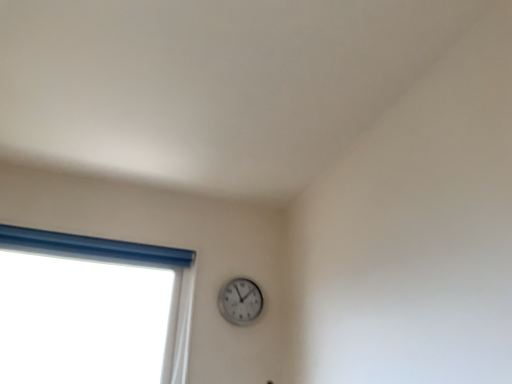
What are the coordinates of `white plastic wall clock at upper center` in the screenshot? It's located at (240, 301).

The height and width of the screenshot is (384, 512). Describe the element at coordinates (240, 301) in the screenshot. I see `white plastic wall clock at upper center` at that location.

Identify the location of white plastic window at left. (90, 309).

What do you see at coordinates (90, 309) in the screenshot?
I see `white plastic window at left` at bounding box center [90, 309].

What is the approximate height of white plastic window at left?

A: It is 28.00 inches.

The image size is (512, 384). I want to click on white plastic wall clock at upper center, so click(x=240, y=301).

Visually, is white plastic window at left positioned to the left or to the right of white plastic wall clock at upper center?

white plastic window at left is to the left of white plastic wall clock at upper center.

Does white plastic window at left come behind white plastic wall clock at upper center?

No, the depth of white plastic window at left is less than that of white plastic wall clock at upper center.

Does point (97, 320) come farther from viewer compared to point (244, 304)?

Yes.

From the image's perspective, between white plastic window at left and white plastic wall clock at upper center, which one is located above?

white plastic wall clock at upper center, from the image's perspective.

Looking at this image, from a real-world perspective, is white plastic window at left positioned over white plastic wall clock at upper center based on gravity?

Incorrect, from a real-world perspective, white plastic window at left is lower than white plastic wall clock at upper center.

Considering the sizes of white plastic window at left and white plastic wall clock at upper center in the image, is white plastic window at left wider or thinner than white plastic wall clock at upper center?

Considering their sizes, white plastic window at left looks broader than white plastic wall clock at upper center.

Is white plastic window at left shorter than white plastic wall clock at upper center?

In fact, white plastic window at left may be taller than white plastic wall clock at upper center.

Is white plastic window at left bigger or smaller than white plastic wall clock at upper center?

In the image, white plastic window at left appears to be larger than white plastic wall clock at upper center.

Could white plastic wall clock at upper center be considered to be inside white plastic window at left?

No, white plastic wall clock at upper center is located outside of white plastic window at left.

Can you see white plastic window at left touching white plastic wall clock at upper center?

white plastic window at left and white plastic wall clock at upper center are not in contact.

Could you tell me if white plastic window at left is turned towards white plastic wall clock at upper center?

No, white plastic window at left is not turned towards white plastic wall clock at upper center.

Identify the location of wall clock lying above the white plastic window at left (from the image's perspective). [x=240, y=301].

Visually, is white plastic wall clock at upper center positioned to the left or to the right of white plastic window at left?

white plastic wall clock at upper center is to the right of white plastic window at left.

Who is more distant, white plastic wall clock at upper center or white plastic window at left?

white plastic wall clock at upper center is behind.

Based on the photo, which point is more forward, (259, 292) or (174, 256)?

The point (174, 256) is closer.

From the image's perspective, who appears lower, white plastic wall clock at upper center or white plastic window at left?

white plastic window at left.

From a real-world perspective, is white plastic wall clock at upper center above or below white plastic window at left?

Clearly, from a real-world perspective, white plastic wall clock at upper center is above white plastic window at left.

Can you confirm if white plastic wall clock at upper center is thinner than white plastic window at left?

Indeed, white plastic wall clock at upper center has a lesser width compared to white plastic window at left.

Can you confirm if white plastic wall clock at upper center is taller than white plastic window at left?

No, white plastic wall clock at upper center is not taller than white plastic window at left.

Considering the relative sizes of white plastic wall clock at upper center and white plastic window at left in the image provided, is white plastic wall clock at upper center bigger than white plastic window at left?

Incorrect, white plastic wall clock at upper center is not larger than white plastic window at left.

Could white plastic window at left be considered to be inside white plastic wall clock at upper center?

No, white plastic window at left is not a part of white plastic wall clock at upper center.

Based on the photo, is the surface of white plastic wall clock at upper center in direct contact with white plastic window at left?

white plastic wall clock at upper center is not next to white plastic window at left, and they're not touching.

Could you tell me if white plastic wall clock at upper center is turned towards white plastic window at left?

No, white plastic wall clock at upper center is not facing towards white plastic window at left.

How distant is white plastic wall clock at upper center from white plastic window at left?

A distance of 23.59 inches exists between white plastic wall clock at upper center and white plastic window at left.

I want to click on wall clock on the right of white plastic window at left, so click(240, 301).

Find the location of a particular element. window below the white plastic wall clock at upper center (from the image's perspective) is located at coordinates (90, 309).

This screenshot has width=512, height=384. I want to click on wall clock that is behind the white plastic window at left, so click(240, 301).